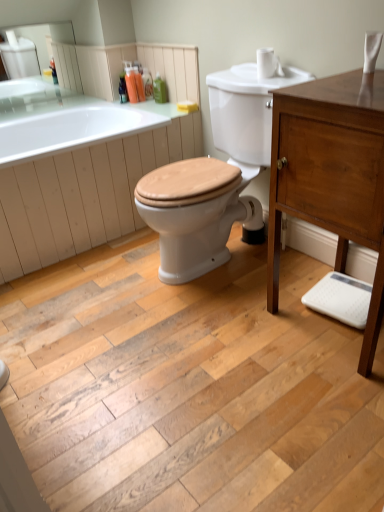
At what (x,y) coordinates should I click in order to perform the action: click on free space in front of matte brown cabinet at right. Please return your answer as a coordinate pair (x, y). The height and width of the screenshot is (512, 384). Looking at the image, I should click on (329, 408).